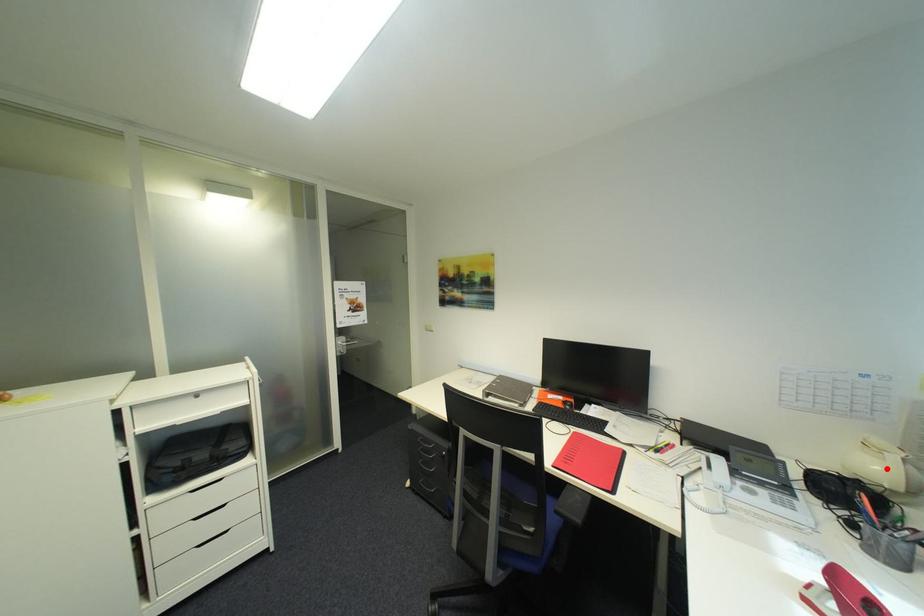
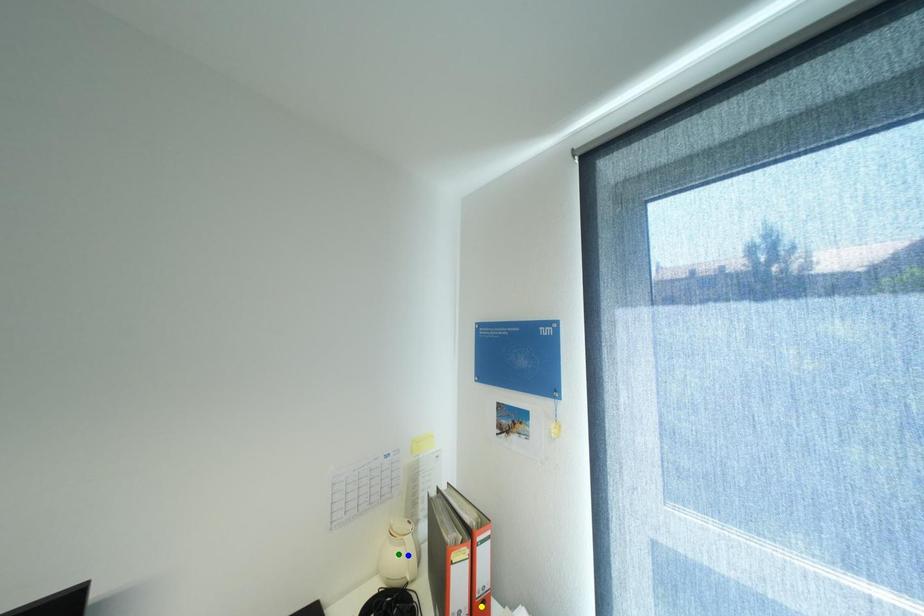
Question: I am providing you with two images of the same scene from different viewpoints. A red point is marked on the first image. You are given multiple points on the second image. Which point in image 2 is actually the same real-world point as the red point in image 1?

Choices:
 (A) yellow point
 (B) blue point
 (C) green point

Answer: (B)